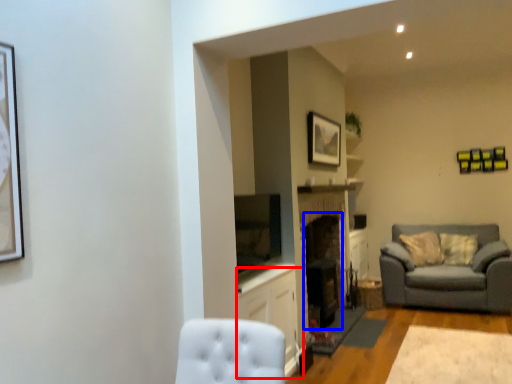
Question: Among these objects, which one is nearest to the camera, cabinetry (highlighted by a red box) or fireplace (highlighted by a blue box)?

Choices:
 (A) cabinetry
 (B) fireplace

Answer: (A)